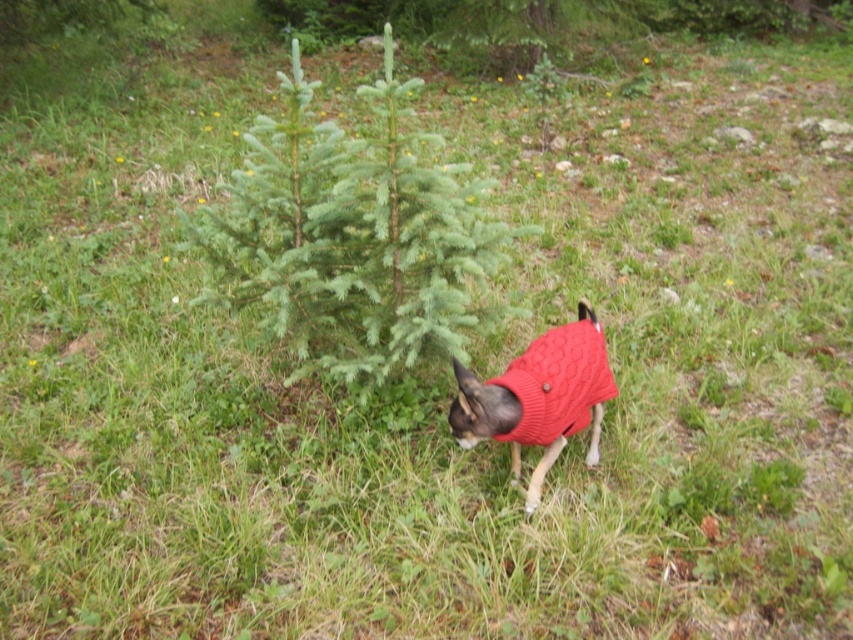
You are a photographer trying to capture the perfect shot of the dog in the grassy area. You notice two points in the scene labeled as point [310,138] and point [553,449]. Which point is closer to your camera lens?

Point [310,138] is further to the camera than point [553,449], so the closer point to the camera lens is point [553,449].